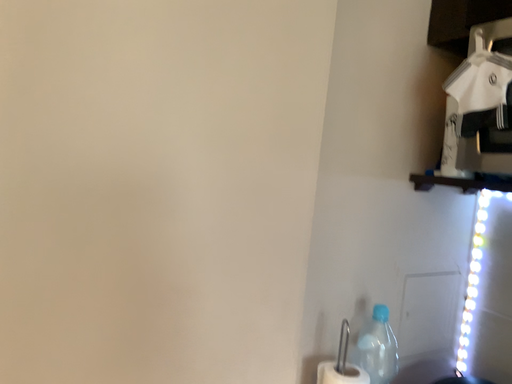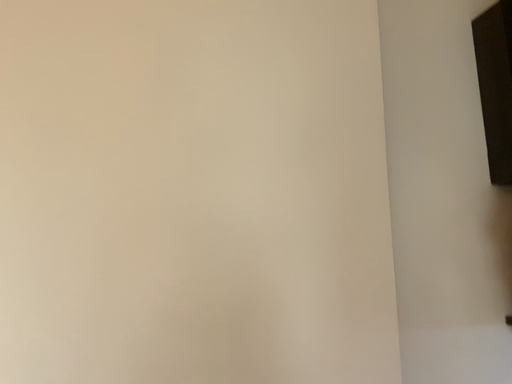
Question: Which way did the camera rotate in the video?

Choices:
 (A) rotated downward
 (B) rotated upward

Answer: (B)